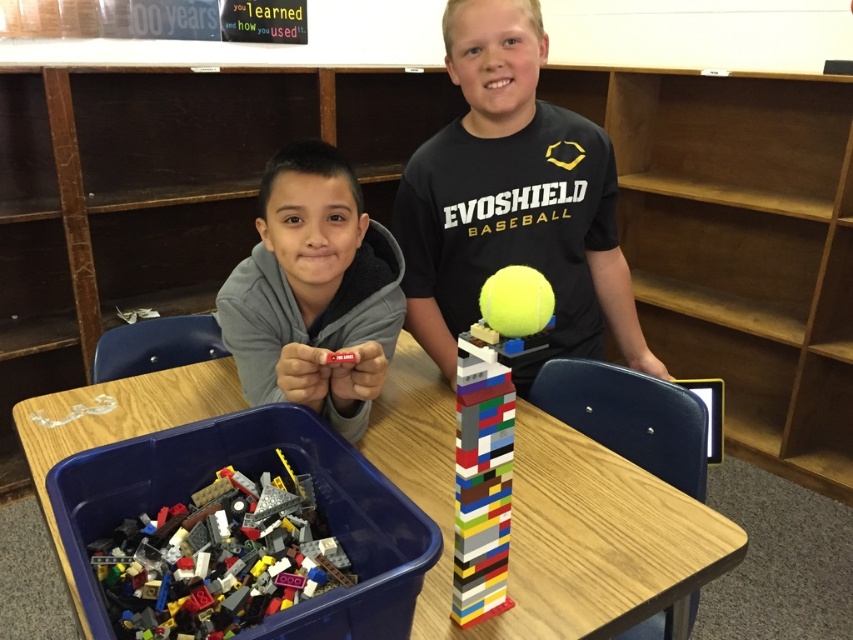
Does wooden table at center appear under multicolored plastic tower at center?

Indeed, wooden table at center is positioned under multicolored plastic tower at center.

Which is behind, point (693, 570) or point (465, 440)?

Point (693, 570)

The height and width of the screenshot is (640, 853). What are the coordinates of `wooden table at center` in the screenshot? It's located at (549, 520).

Is wooden table at center shorter than multicolored plastic lego pieces at lower left?

No, wooden table at center is not shorter than multicolored plastic lego pieces at lower left.

Image resolution: width=853 pixels, height=640 pixels. What do you see at coordinates (549, 520) in the screenshot?
I see `wooden table at center` at bounding box center [549, 520].

What do you see at coordinates (549, 520) in the screenshot? The height and width of the screenshot is (640, 853). I see `wooden table at center` at bounding box center [549, 520].

At what (x,y) coordinates should I click in order to perform the action: click on wooden table at center. Please return your answer as a coordinate pair (x, y). The image size is (853, 640). Looking at the image, I should click on (549, 520).

Does matte black shirt at center come behind multicolored plastic tower at center?

Yes, matte black shirt at center is behind multicolored plastic tower at center.

I want to click on matte black shirt at center, so click(512, 200).